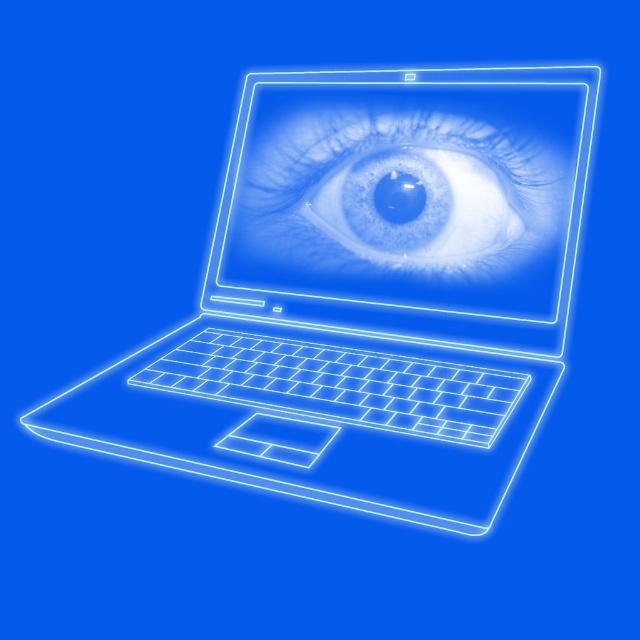
In the scene shown: Is neon white laptop at center below translucent blue eye at center?

Yes.

Who is positioned more to the right, neon white laptop at center or translucent blue eye at center?

From the viewer's perspective, translucent blue eye at center appears more on the right side.

Who is more forward, (x=307, y=477) or (x=376, y=157)?

Positioned in front is point (x=307, y=477).

At what (x,y) coordinates should I click in order to perform the action: click on neon white laptop at center. Please return your answer as a coordinate pair (x, y). This screenshot has height=640, width=640. Looking at the image, I should click on (369, 296).